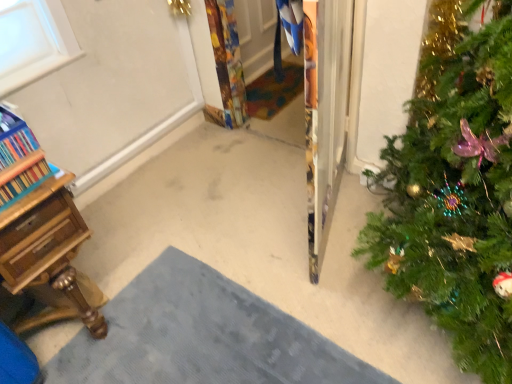
Where is `vacant space that's between wooden desk at lower left and gray textured doormat at lower center, arranged as the second doormat when viewed from the top`? Image resolution: width=512 pixels, height=384 pixels. vacant space that's between wooden desk at lower left and gray textured doormat at lower center, arranged as the second doormat when viewed from the top is located at coordinates (93, 278).